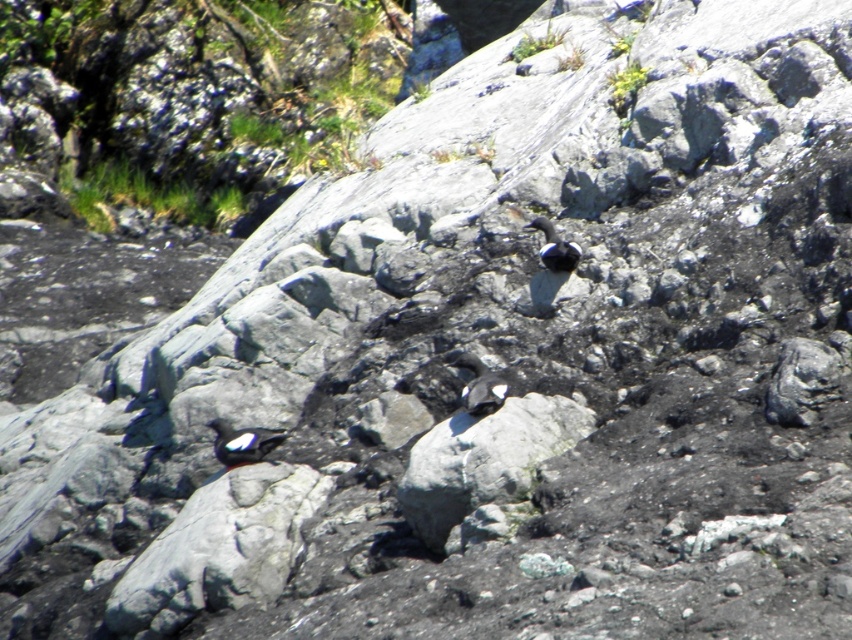
Question: Estimate the real-world distances between objects in this image. Which object is closer to the black matte bird at center?

Choices:
 (A) white matte bird at center
 (B) gray rough rock at lower left

Answer: (B)

Question: Which object is farther from the camera taking this photo?

Choices:
 (A) gray rough rock at lower left
 (B) black matte bird at upper center

Answer: (B)

Question: Is gray rough rock at lower left smaller than black matte bird at upper center?

Choices:
 (A) no
 (B) yes

Answer: (A)

Question: Is white matte bird at center below black matte bird at upper center?

Choices:
 (A) no
 (B) yes

Answer: (B)

Question: Estimate the real-world distances between objects in this image. Which object is closer to the gray rough rock at lower left?

Choices:
 (A) white matte bird at center
 (B) black matte bird at upper center

Answer: (A)

Question: Is black matte bird at center bigger than black matte bird at upper center?

Choices:
 (A) yes
 (B) no

Answer: (A)